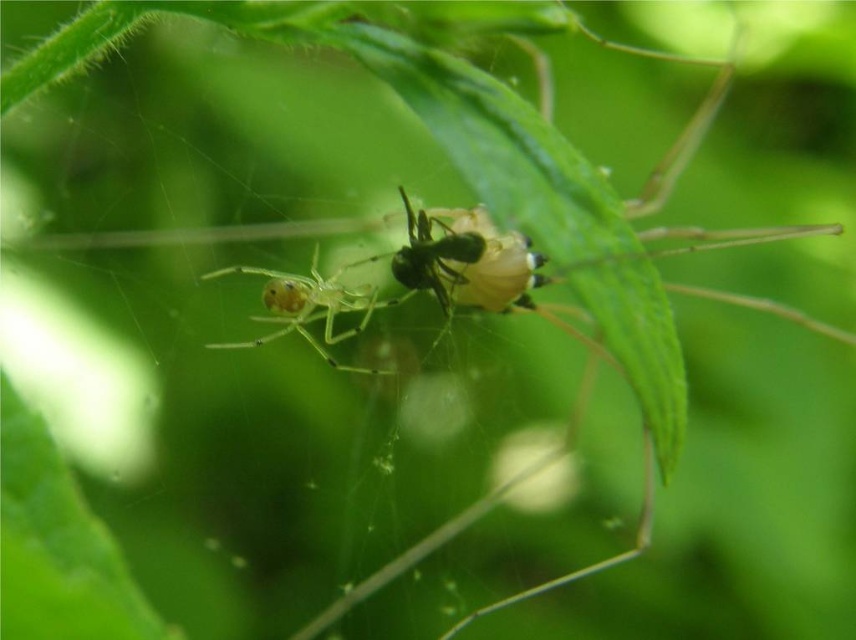
You are an entomologist observing a spider web with two spiders. You notice two points on the web at coordinates point (227, 348) and point (414, 284). Which point is closer to the observer?

Point (414, 284) is closer to the observer because point (227, 348) is behind it.